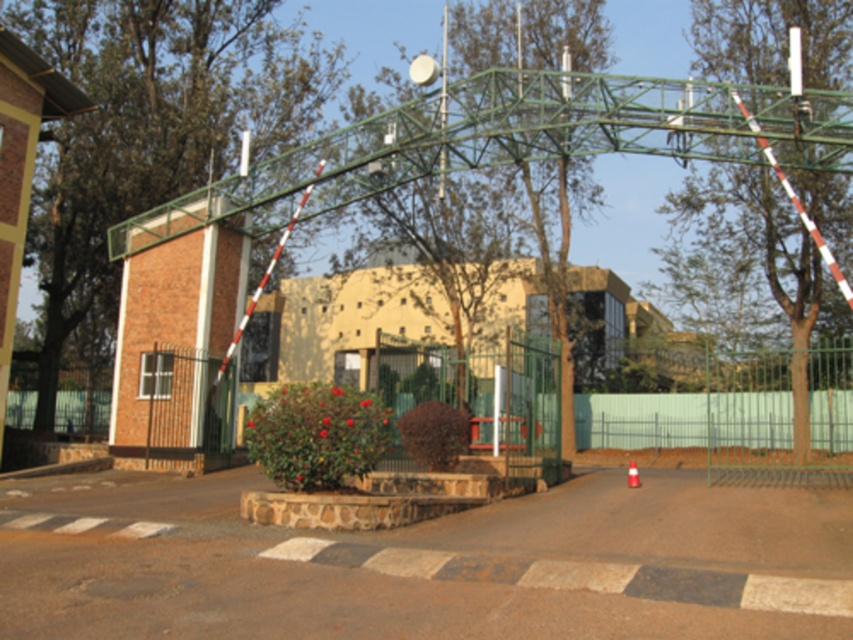
Question: Among these objects, which one is farthest from the camera?

Choices:
 (A) metallic fence at center
 (B) green metal fence at right

Answer: (A)

Question: Which of the following is the farthest from the observer?

Choices:
 (A) green metal fence at right
 (B) metallic fence at center

Answer: (B)

Question: Does green metal fence at right have a lesser width compared to metallic fence at center?

Choices:
 (A) yes
 (B) no

Answer: (B)

Question: Can you confirm if green metal fence at right is smaller than metallic fence at center?

Choices:
 (A) yes
 (B) no

Answer: (B)

Question: Which point is farther from the camera taking this photo?

Choices:
 (A) (747, 456)
 (B) (756, 403)

Answer: (B)

Question: Is green metal fence at right thinner than metallic fence at center?

Choices:
 (A) no
 (B) yes

Answer: (A)